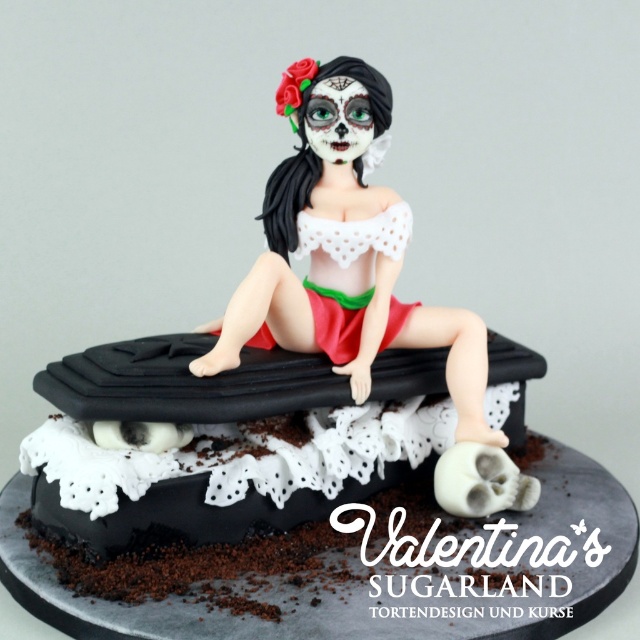
You are planning to take a photo of the black glossy chocolate cake at center and the matte white sugar figure at center for a magazine spread. The editor wants the cake to be the focal point. Based on their current arrangement, which object is positioned to the left of the other, and would this placement naturally draw attention to the cake?

The black glossy chocolate cake at center is positioned on the left side of the matte white sugar figure at center. Since the cake is on the left, depending on the viewer, it might not naturally draw attention to it as the focal point unless the layout is adjusted to emphasize its position.

You are a baker who wants to place a decorative candle exactly at the center of the black glossy chocolate cake at center. According to the coordinates provided, where should you place the candle?

The candle should be placed at the coordinates point (195,464) on the black glossy chocolate cake at center.

You are a baker who wants to place a small candle on the matte white sugar figure at center. Given that the cake is the black glossy chocolate cake at center, which has a larger width, do you think the candle will fit on the figure without falling off?

The black glossy chocolate cake at center is wider than the matte white sugar figure at center. Since the cake is wider, the figure is smaller in width, so placing a candle might cause it to be unstable. It would be better to place the candle on the wider black glossy chocolate cake at center instead.